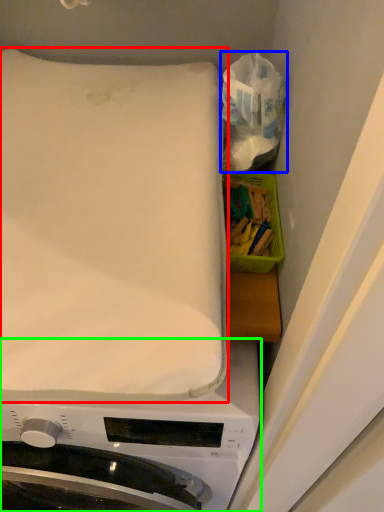
Question: Estimate the real-world distances between objects in this image. Which object is farther from mattress (highlighted by a red box), tissue (highlighted by a blue box) or washing machine (highlighted by a green box)?

Choices:
 (A) tissue
 (B) washing machine

Answer: (B)